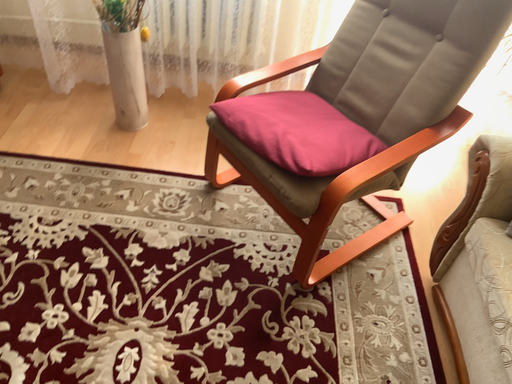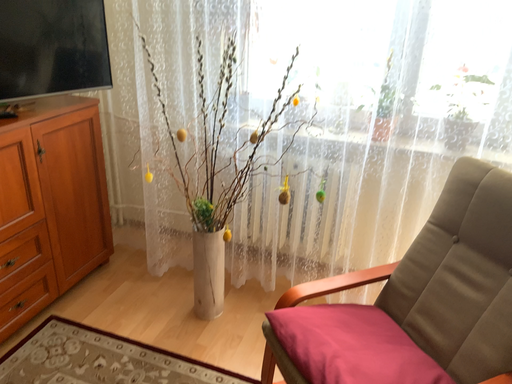
Question: How did the camera likely rotate when shooting the video?

Choices:
 (A) rotated left
 (B) rotated right

Answer: (A)